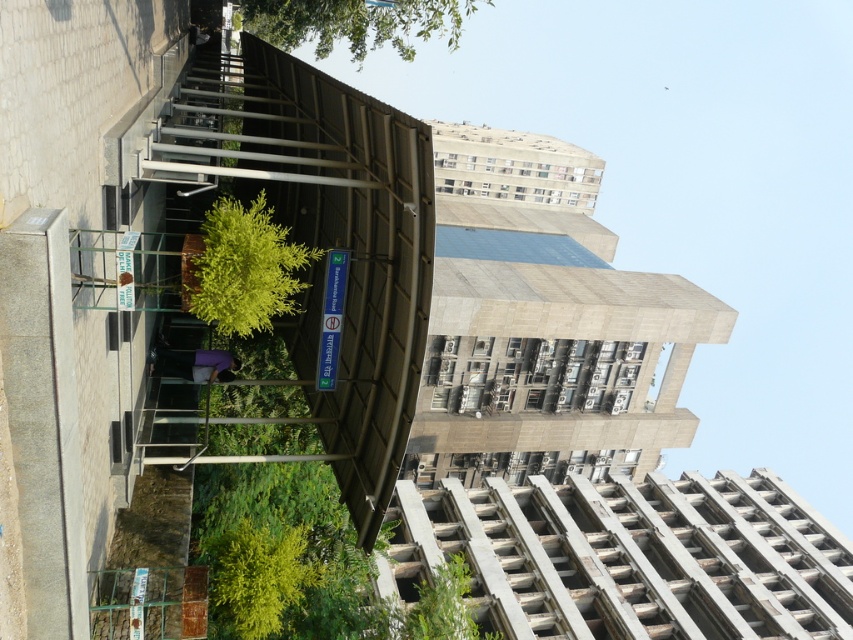
Question: Is green leafy tree at center smaller than green leafy tree at upper center?

Choices:
 (A) yes
 (B) no

Answer: (A)

Question: Which object appears closest to the camera in this image?

Choices:
 (A) green leafy tree at center
 (B) green leafy tree at upper center

Answer: (A)

Question: Which of the following is the farthest from the observer?

Choices:
 (A) green leafy tree at center
 (B) green leafy tree at upper center

Answer: (B)

Question: Is green leafy tree at center bigger than green leafy tree at upper center?

Choices:
 (A) yes
 (B) no

Answer: (B)

Question: Is green leafy tree at center positioned in front of green leafy tree at upper center?

Choices:
 (A) yes
 (B) no

Answer: (A)